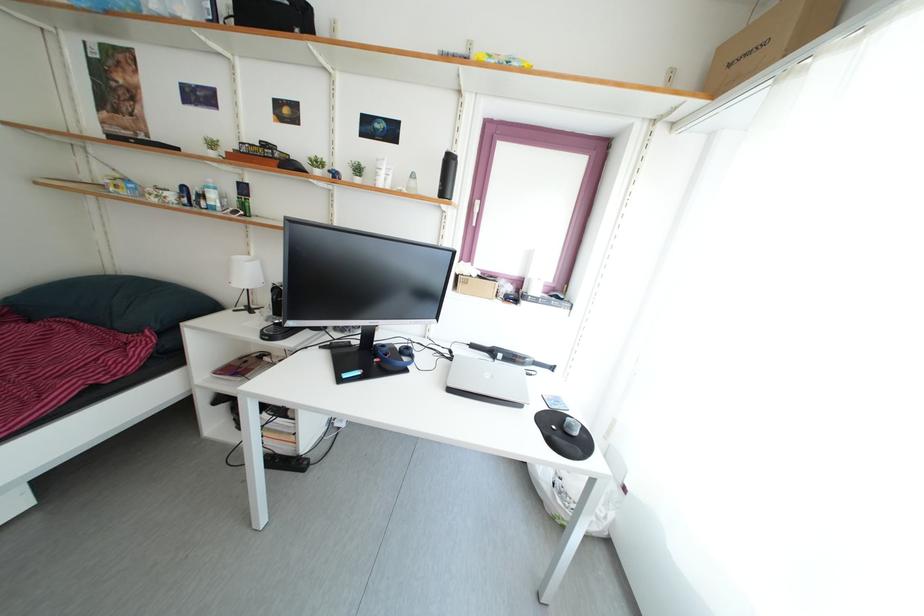
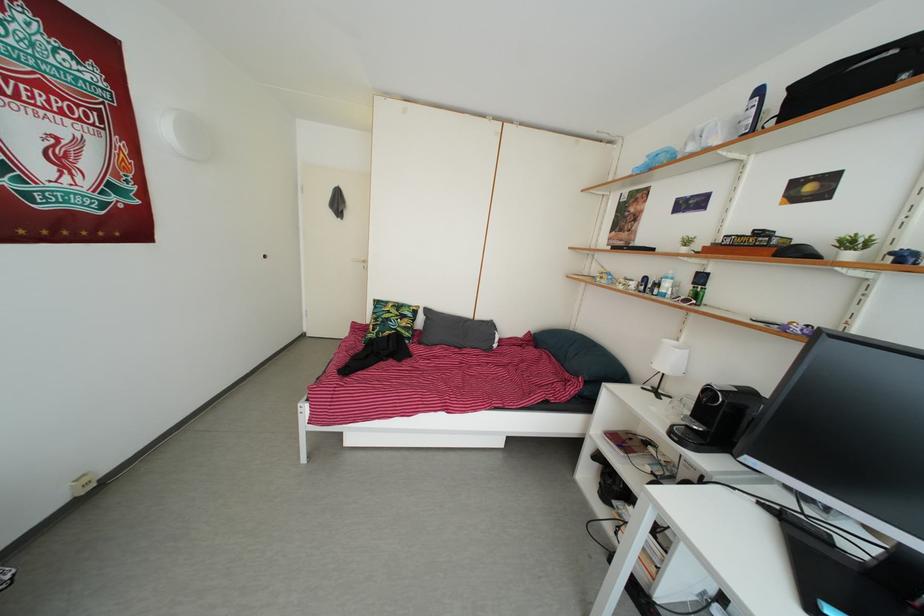
Question: I am providing you with two images of the same scene from different viewpoints. After the viewpoint changes to image2, which objects are now occluded?

Choices:
 (A) blue spray bottle
 (B) white door handle
 (C) bed sitting surface
 (D) none of these

Answer: (D)